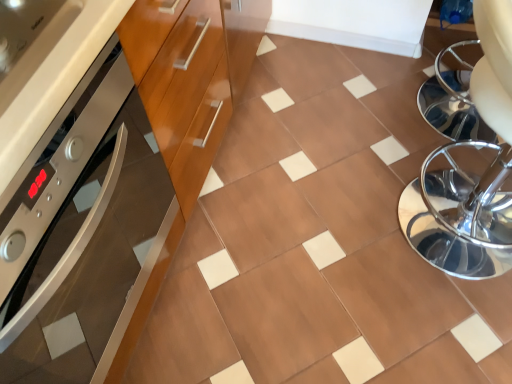
Question: Is brown glossy tile at center located within wooden cabinet at left?

Choices:
 (A) yes
 (B) no

Answer: (B)

Question: From the image's perspective, is wooden cabinet at left on top of brown glossy tile at center?

Choices:
 (A) yes
 (B) no

Answer: (B)

Question: Can you confirm if wooden cabinet at left is shorter than brown glossy tile at center?

Choices:
 (A) yes
 (B) no

Answer: (B)

Question: Is wooden cabinet at left aimed at brown glossy tile at center?

Choices:
 (A) no
 (B) yes

Answer: (B)

Question: Is the position of wooden cabinet at left less distant than that of brown glossy tile at center?

Choices:
 (A) yes
 (B) no

Answer: (A)

Question: Is wooden cabinet at left further to camera compared to brown glossy tile at center?

Choices:
 (A) yes
 (B) no

Answer: (B)

Question: Can you confirm if wooden cabinet at left is taller than polished chrome swivel chair at right?

Choices:
 (A) yes
 (B) no

Answer: (A)

Question: Is wooden cabinet at left at the left side of polished chrome swivel chair at right?

Choices:
 (A) no
 (B) yes

Answer: (B)

Question: Would you say wooden cabinet at left contains polished chrome swivel chair at right?

Choices:
 (A) yes
 (B) no

Answer: (B)

Question: Does wooden cabinet at left lie in front of polished chrome swivel chair at right?

Choices:
 (A) no
 (B) yes

Answer: (B)

Question: Is wooden cabinet at left aimed at polished chrome swivel chair at right?

Choices:
 (A) yes
 (B) no

Answer: (A)

Question: Is wooden cabinet at left positioned beyond the bounds of polished chrome swivel chair at right?

Choices:
 (A) yes
 (B) no

Answer: (A)

Question: Is there a large distance between brown glossy tile at center and polished chrome swivel chair at right?

Choices:
 (A) yes
 (B) no

Answer: (B)